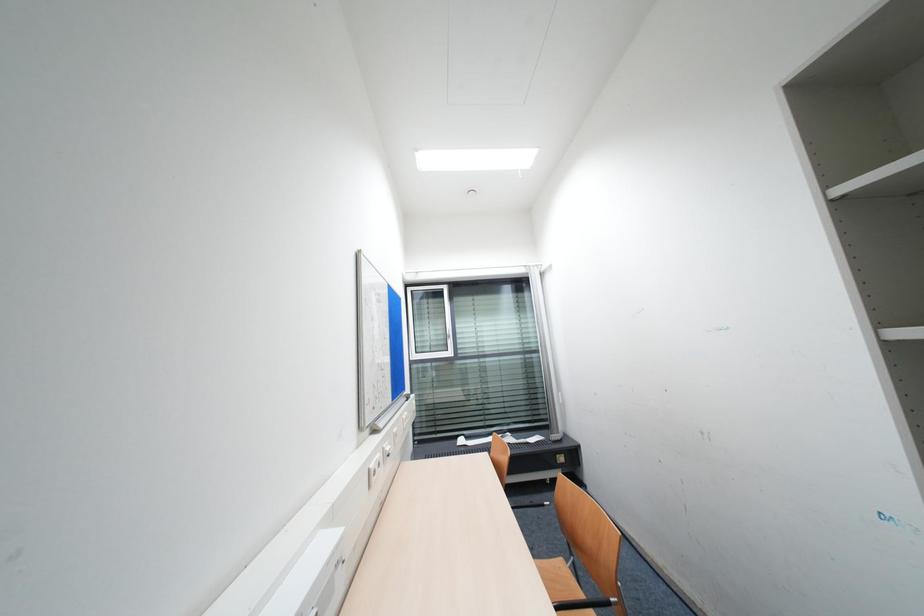
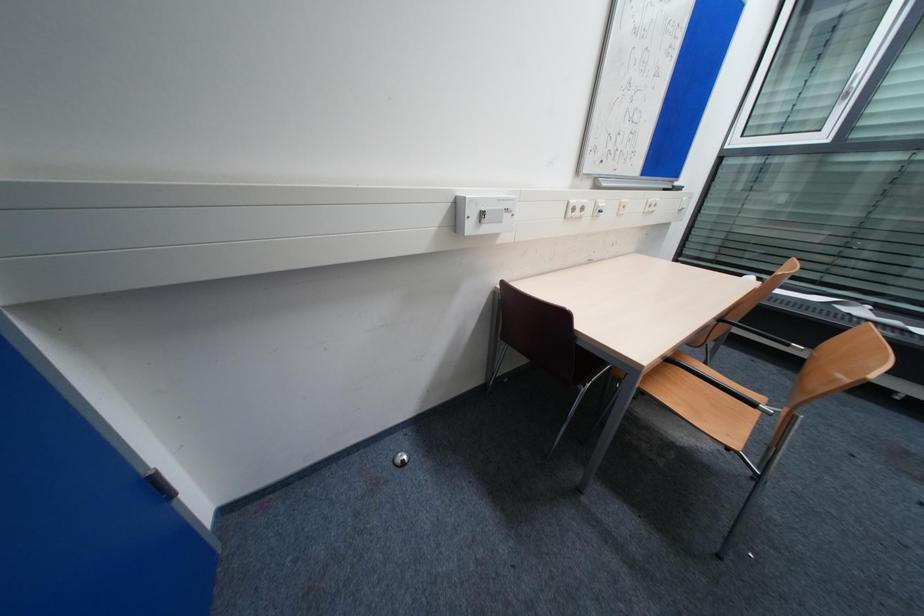
Based on the continuous images, in which direction is the camera rotating?

The camera's rotation is toward left-down.